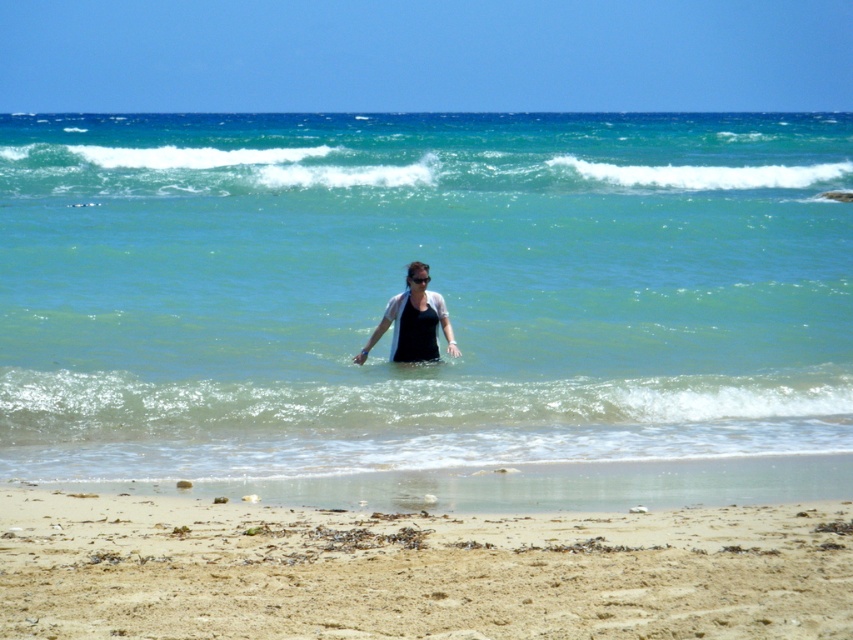
You are a swimmer planning to dive into the water. You see the green translucent water at upper center and the black matte wetsuit at center. Which object is positioned higher from the ground?

The green translucent water at upper center is located above the black matte wetsuit at center, so it is positioned higher from the ground.